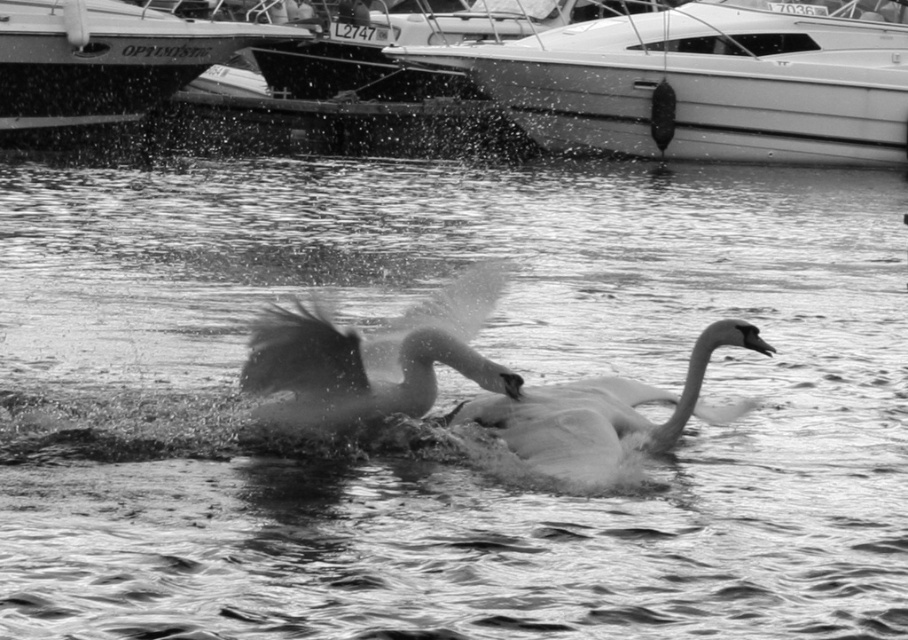
You are a wildlife photographer trying to capture the moment when the silvery feathered swan at center and the smooth white swan at center are both fully visible in your shot. Given their current positions and movements, which swan might be easier to focus on and why?

The smooth white swan at center is easier to focus on because it is stationary, while the silvery feathered swan at center is in motion, making it harder to capture clearly.

You are a photographer trying to capture the metallic boat at upper left and the silvery feathered swan at center in the same frame. Based on their sizes, which object should you focus on first to ensure both are in the frame?

The metallic boat at upper left is larger than the silvery feathered swan at center, so you should focus on the metallic boat at upper left first to ensure both fit in the frame.